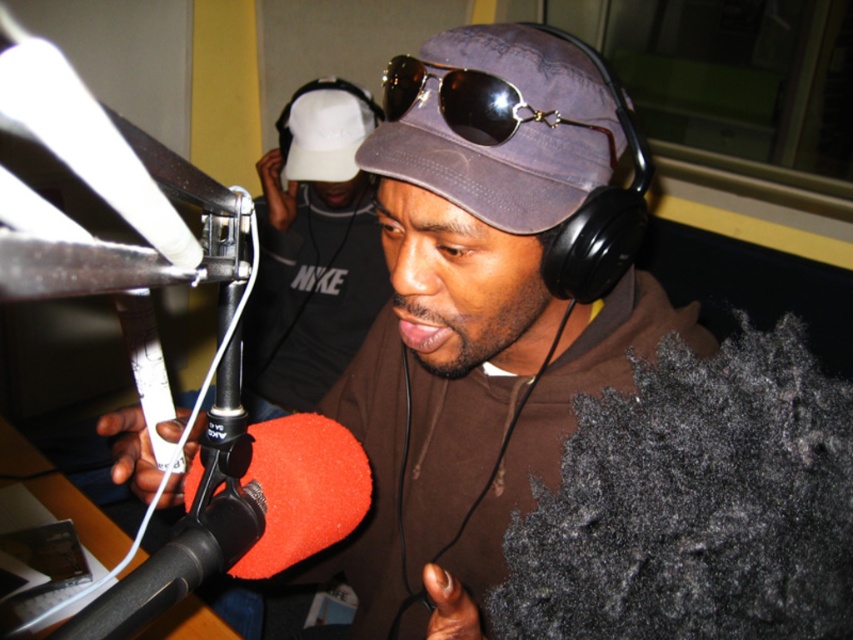
Is brown matte hoodie at center above gold reflective aviator sunglasses at center?

No.

Is the position of brown matte hoodie at center more distant than that of gold reflective aviator sunglasses at center?

That is False.

At what (x,y) coordinates should I click in order to perform the action: click on brown matte hoodie at center. Please return your answer as a coordinate pair (x, y). The width and height of the screenshot is (853, 640). Looking at the image, I should click on (482, 310).

How much distance is there between purple canvas hat at center and white matte baseball cap at upper center?

4.59 feet

Is purple canvas hat at center to the left of white matte baseball cap at upper center from the viewer's perspective?

No, purple canvas hat at center is not to the left of white matte baseball cap at upper center.

Identify the location of purple canvas hat at center. The image size is (853, 640). (498, 124).

Is brown matte hoodie at center taller than purple canvas hat at center?

Yes, brown matte hoodie at center is taller than purple canvas hat at center.

Does point (102, 422) come behind point (386, 164)?

That is True.

Who is more forward, (383, 564) or (492, 52)?

Point (492, 52) is in front.

Locate an element on the screen. brown matte hoodie at center is located at coordinates (x=482, y=310).